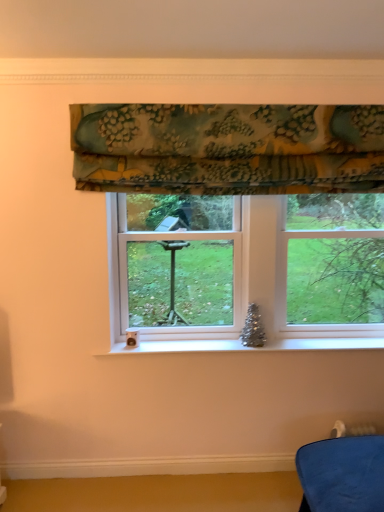
The image size is (384, 512). What do you see at coordinates (228, 148) in the screenshot?
I see `floral fabric valance at upper center` at bounding box center [228, 148].

This screenshot has height=512, width=384. Identify the location of floral fabric valance at upper center. (228, 148).

What is the approximate width of clear glass window at center?

clear glass window at center is 9.65 inches wide.

The image size is (384, 512). What do you see at coordinates (228, 148) in the screenshot?
I see `clear glass window at center` at bounding box center [228, 148].

Locate an element on the screen. The height and width of the screenshot is (512, 384). clear glass window at center is located at coordinates (228, 148).

In order to face clear glass window at center, should I rotate leftwards or rightwards?

A 9.054 degree turn to the right will do.

In order to click on floral fabric valance at upper center in this screenshot , I will do `click(228, 148)`.

In the scene shown: Based on their positions, is floral fabric valance at upper center located to the left or right of clear glass window at center?

Clearly, floral fabric valance at upper center is on the left of clear glass window at center in the image.

Between floral fabric valance at upper center and clear glass window at center, which one is positioned in front?

floral fabric valance at upper center.

Which point is more forward, (299, 135) or (238, 265)?

The point (299, 135) is closer.

From the image's perspective, who appears lower, floral fabric valance at upper center or clear glass window at center?

clear glass window at center, from the image's perspective.

From a real-world perspective, is floral fabric valance at upper center on clear glass window at center?

Yes, from a real-world perspective, floral fabric valance at upper center is over clear glass window at center

Does floral fabric valance at upper center have a lesser width compared to clear glass window at center?

Indeed, floral fabric valance at upper center has a lesser width compared to clear glass window at center.

Who is shorter, floral fabric valance at upper center or clear glass window at center?

floral fabric valance at upper center.

Is floral fabric valance at upper center bigger or smaller than clear glass window at center?

Considering their sizes, floral fabric valance at upper center takes up less space than clear glass window at center.

Is floral fabric valance at upper center not inside clear glass window at center?

That's correct, floral fabric valance at upper center is outside of clear glass window at center.

Is floral fabric valance at upper center beside clear glass window at center?

Yes, floral fabric valance at upper center is with clear glass window at center.

Is floral fabric valance at upper center oriented away from clear glass window at center?

No, floral fabric valance at upper center is not facing the opposite direction of clear glass window at center.

How far apart are floral fabric valance at upper center and clear glass window at center?

floral fabric valance at upper center and clear glass window at center are 0.58 inches apart from each other.

The height and width of the screenshot is (512, 384). I want to click on curtain that is on the left side of clear glass window at center, so click(x=228, y=148).

Considering the relative positions of clear glass window at center and floral fabric valance at upper center in the image provided, is clear glass window at center to the left of floral fabric valance at upper center from the viewer's perspective?

In fact, clear glass window at center is to the right of floral fabric valance at upper center.

In the scene shown: Is the position of clear glass window at center less distant than that of floral fabric valance at upper center?

No, clear glass window at center is further to the viewer.

Is point (156, 138) closer or farther from the camera than point (309, 108)?

Point (156, 138) is positioned closer to the camera compared to point (309, 108).

From the image's perspective, which one is positioned higher, clear glass window at center or floral fabric valance at upper center?

floral fabric valance at upper center.

From a real-world perspective, is clear glass window at center above or below floral fabric valance at upper center?

From a real-world perspective, clear glass window at center is physically below floral fabric valance at upper center.

Between clear glass window at center and floral fabric valance at upper center, which one has smaller width?

floral fabric valance at upper center.

In terms of height, does clear glass window at center look taller or shorter compared to floral fabric valance at upper center?

clear glass window at center is taller than floral fabric valance at upper center.

Considering the relative sizes of clear glass window at center and floral fabric valance at upper center in the image provided, is clear glass window at center smaller than floral fabric valance at upper center?

Actually, clear glass window at center might be larger than floral fabric valance at upper center.

Is clear glass window at center spatially inside floral fabric valance at upper center, or outside of it?

clear glass window at center exists outside the volume of floral fabric valance at upper center.

Does clear glass window at center touch floral fabric valance at upper center?

Absolutely, clear glass window at center is next to and touching floral fabric valance at upper center.

Is clear glass window at center aimed at floral fabric valance at upper center?

No, clear glass window at center does not turn towards floral fabric valance at upper center.

How much distance is there between clear glass window at center and floral fabric valance at upper center?

clear glass window at center is 1.48 centimeters away from floral fabric valance at upper center.

Where is `curtain that appears above the clear glass window at center (from the image's perspective)`? curtain that appears above the clear glass window at center (from the image's perspective) is located at coordinates (228, 148).

Where is `curtain above the clear glass window at center (from a real-world perspective)`? curtain above the clear glass window at center (from a real-world perspective) is located at coordinates (228, 148).

This screenshot has width=384, height=512. I want to click on window on the right of floral fabric valance at upper center, so click(x=228, y=148).